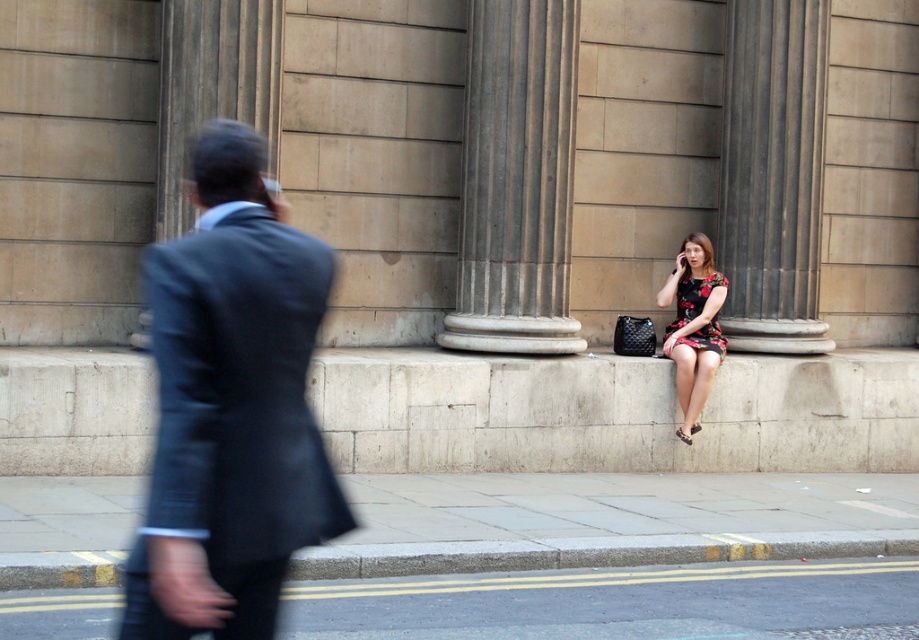
Question: Which point is closer to the camera taking this photo?

Choices:
 (A) (x=745, y=244)
 (B) (x=785, y=593)
 (C) (x=55, y=577)

Answer: (C)

Question: Does dark gray suit at left have a larger size compared to floral dress at center?

Choices:
 (A) no
 (B) yes

Answer: (A)

Question: Which point is closer to the camera?

Choices:
 (A) floral-patterned fabric dress at lower right
 (B) smooth asphalt road at lower center
 (C) floral dress at center

Answer: (B)

Question: Considering the real-world distances, which object is farthest from the floral dress at center?

Choices:
 (A) dark gray suit at left
 (B) yellow painted concrete curb at lower left

Answer: (A)

Question: Is smooth asphalt road at lower center smaller than floral-patterned fabric dress at lower right?

Choices:
 (A) no
 (B) yes

Answer: (A)

Question: Can you confirm if dark gray suit at left is positioned to the right of yellow painted concrete curb at lower left?

Choices:
 (A) no
 (B) yes

Answer: (A)